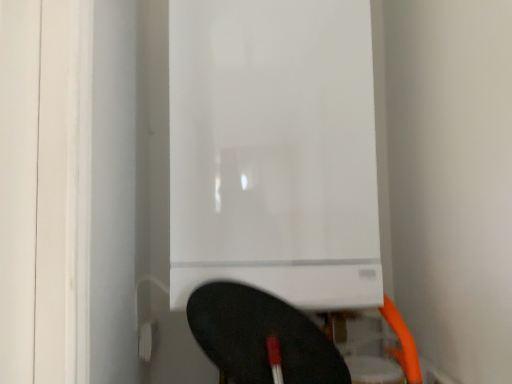
Locate an element on the screen. The height and width of the screenshot is (384, 512). white glossy boiler at center is located at coordinates (274, 150).

Describe the element at coordinates (274, 150) in the screenshot. The width and height of the screenshot is (512, 384). I see `white glossy boiler at center` at that location.

Find the location of a particular element. This screenshot has height=384, width=512. white glossy boiler at center is located at coordinates (274, 150).